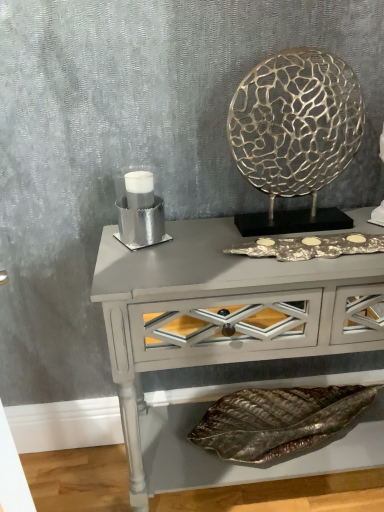
Question: Can you confirm if silver metallic candle holder at left is smaller than matte gray console table at center?

Choices:
 (A) yes
 (B) no

Answer: (A)

Question: Can you confirm if silver metallic candle holder at left is positioned to the left of matte gray console table at center?

Choices:
 (A) yes
 (B) no

Answer: (A)

Question: From a real-world perspective, is silver metallic candle holder at left positioned over matte gray console table at center based on gravity?

Choices:
 (A) no
 (B) yes

Answer: (B)

Question: Does silver metallic candle holder at left have a lesser width compared to matte gray console table at center?

Choices:
 (A) no
 (B) yes

Answer: (B)

Question: Considering the relative positions of silver metallic candle holder at left and matte gray console table at center in the image provided, is silver metallic candle holder at left to the right of matte gray console table at center from the viewer's perspective?

Choices:
 (A) yes
 (B) no

Answer: (B)

Question: Is silver metallic candle holder at left directly adjacent to matte gray console table at center?

Choices:
 (A) no
 (B) yes

Answer: (A)

Question: From the image's perspective, would you say silver metallic candle holder at left is shown under metallic leaf at lower center?

Choices:
 (A) yes
 (B) no

Answer: (B)

Question: Is silver metallic candle holder at left in front of metallic leaf at lower center?

Choices:
 (A) no
 (B) yes

Answer: (B)

Question: Would you say metallic leaf at lower center is part of silver metallic candle holder at left's contents?

Choices:
 (A) yes
 (B) no

Answer: (B)

Question: Is silver metallic candle holder at left further to the viewer compared to metallic leaf at lower center?

Choices:
 (A) yes
 (B) no

Answer: (B)

Question: From the image's perspective, would you say silver metallic candle holder at left is positioned over metallic leaf at lower center?

Choices:
 (A) no
 (B) yes

Answer: (B)

Question: Does silver metallic candle holder at left turn towards metallic leaf at lower center?

Choices:
 (A) no
 (B) yes

Answer: (A)

Question: Does metallic leaf at lower center appear on the left side of silver metallic candle holder at left?

Choices:
 (A) no
 (B) yes

Answer: (A)